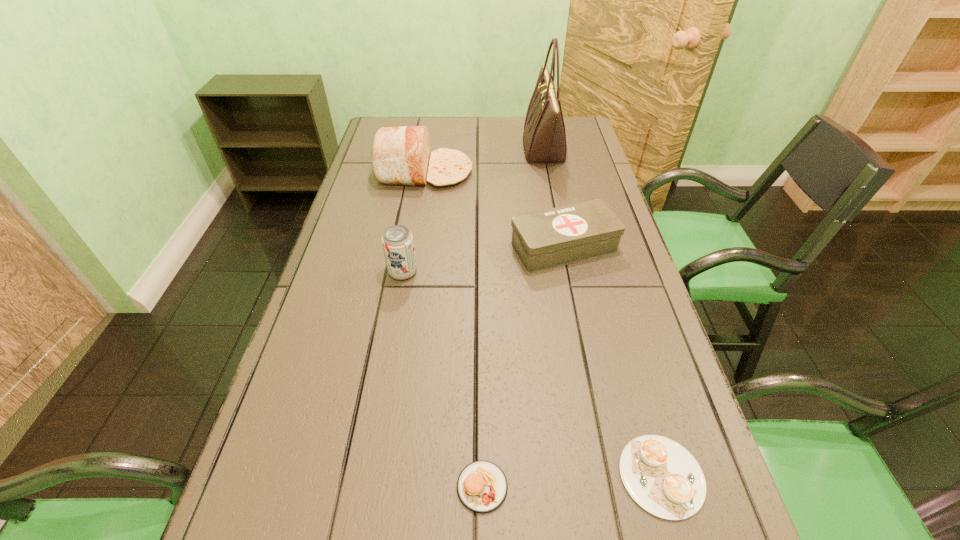
The height and width of the screenshot is (540, 960). I want to click on vacant space at the far edge of the desktop, so click(504, 132).

At what (x,y) coordinates should I click in order to perform the action: click on free location at the left edge of the desktop. Please return your answer as a coordinate pair (x, y). Looking at the image, I should click on (375, 255).

Locate an element on the screen. Image resolution: width=960 pixels, height=540 pixels. vacant space at the right edge of the desktop is located at coordinates [x=695, y=525].

The height and width of the screenshot is (540, 960). Find the location of `blank space at the far left corner`. blank space at the far left corner is located at coordinates (373, 136).

Where is `unoccupied area between the patty and the shortest object`? unoccupied area between the patty and the shortest object is located at coordinates (572, 481).

At what (x,y) coordinates should I click in order to perform the action: click on free space between the patty and the first-aid kit. Please return your answer as a coordinate pair (x, y). Looking at the image, I should click on (523, 367).

Find the location of `vacant space in between the third shortest object and the second shortest object`. vacant space in between the third shortest object and the second shortest object is located at coordinates (523, 367).

The height and width of the screenshot is (540, 960). I want to click on empty space between the bread and the beer can, so click(x=414, y=222).

Where is `vacant area between the bread and the first-aid kit`? The height and width of the screenshot is (540, 960). vacant area between the bread and the first-aid kit is located at coordinates (494, 209).

The width and height of the screenshot is (960, 540). I want to click on free spot between the patty and the shortest object, so click(x=572, y=481).